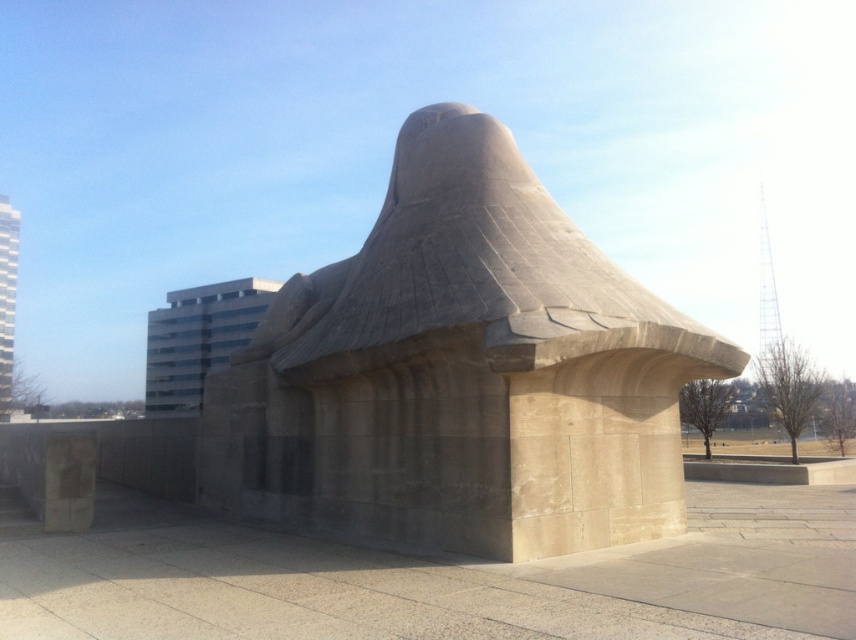
Which is more to the right, smooth concrete sculpture at center or beige stone wall at center?

beige stone wall at center is more to the right.

Between point (396, 298) and point (33, 618), which one is positioned behind?

The point (396, 298) is behind.

Locate an element on the screen. smooth concrete sculpture at center is located at coordinates (461, 372).